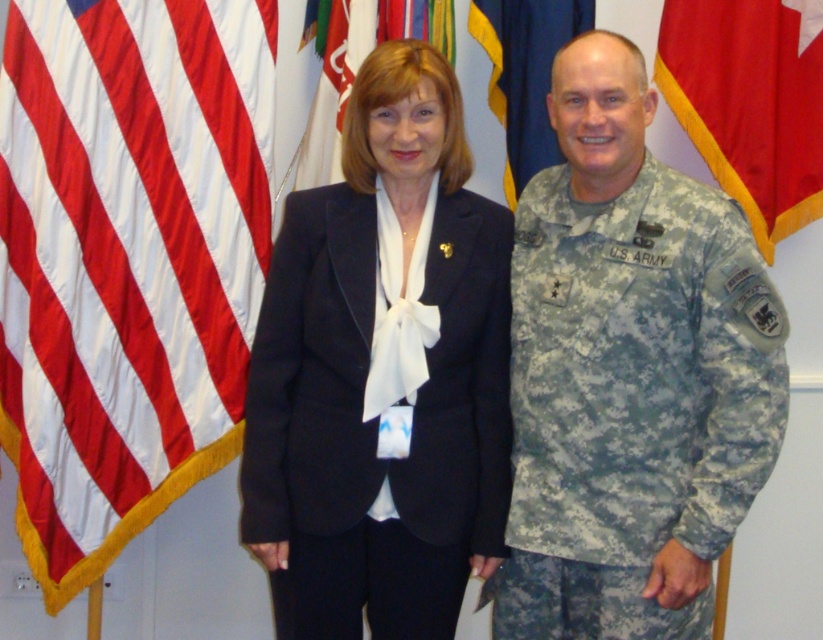
Is red fabric flag at right shorter than white fabric flag at upper center?

Incorrect, red fabric flag at right's height does not fall short of white fabric flag at upper center's.

Is red fabric flag at right positioned before white fabric flag at upper center?

No, it is behind white fabric flag at upper center.

Is point (766, 115) behind point (439, 3)?

Yes, point (766, 115) is behind point (439, 3).

You are a GUI agent. You are given a task and a screenshot of the screen. Output one action in this format:
    pyautogui.click(x=<x>, y=<y>)
    Task: Click on the red fabric flag at right
    This screenshot has height=640, width=823.
    Given the screenshot: What is the action you would take?
    pyautogui.click(x=751, y=102)

Is matte black suit at center shorter than black matte suit at center?

No, matte black suit at center is not shorter than black matte suit at center.

Who is shorter, matte black suit at center or black matte suit at center?

black matte suit at center

Measure the distance between point (421, 134) and camera.

Point (421, 134) and camera are 6.18 feet apart.

The image size is (823, 640). In order to click on matte black suit at center in this screenshot , I will do `click(514, 374)`.

Between matte black suit at center and camouflage fabric us army uniform at right, which one is positioned higher?

matte black suit at center

Does matte black suit at center have a lesser height compared to camouflage fabric us army uniform at right?

Incorrect, matte black suit at center's height does not fall short of camouflage fabric us army uniform at right's.

Locate an element on the screen. matte black suit at center is located at coordinates (514, 374).